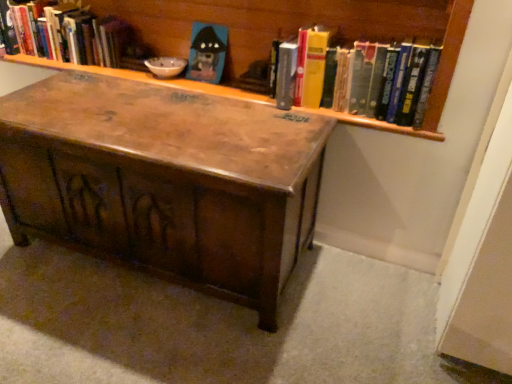
Question: Should I look upward or downward to see hardcover books at upper right, which is the 2th book from left to right?

Choices:
 (A) down
 (B) up

Answer: (B)

Question: Are matte plastic toy at upper center and wooden trunk at center located far from each other?

Choices:
 (A) yes
 (B) no

Answer: (B)

Question: Is matte plastic toy at upper center smaller than wooden trunk at center?

Choices:
 (A) yes
 (B) no

Answer: (A)

Question: Considering the relative sizes of matte plastic toy at upper center and wooden trunk at center in the image provided, is matte plastic toy at upper center shorter than wooden trunk at center?

Choices:
 (A) no
 (B) yes

Answer: (B)

Question: Is matte plastic toy at upper center aimed at wooden trunk at center?

Choices:
 (A) yes
 (B) no

Answer: (B)

Question: Can you confirm if matte plastic toy at upper center is positioned to the right of wooden trunk at center?

Choices:
 (A) yes
 (B) no

Answer: (A)

Question: Can you see matte plastic toy at upper center touching wooden trunk at center?

Choices:
 (A) yes
 (B) no

Answer: (B)

Question: Considering the relative positions of wooden trunk at center and matte plastic toy at upper center in the image provided, is wooden trunk at center to the left of matte plastic toy at upper center from the viewer's perspective?

Choices:
 (A) no
 (B) yes

Answer: (B)

Question: From a real-world perspective, is wooden trunk at center physically above matte plastic toy at upper center?

Choices:
 (A) no
 (B) yes

Answer: (A)

Question: Are wooden trunk at center and matte plastic toy at upper center far apart?

Choices:
 (A) no
 (B) yes

Answer: (A)

Question: From the image's perspective, is wooden trunk at center on top of matte plastic toy at upper center?

Choices:
 (A) yes
 (B) no

Answer: (B)

Question: Considering the relative sizes of wooden trunk at center and matte plastic toy at upper center in the image provided, is wooden trunk at center bigger than matte plastic toy at upper center?

Choices:
 (A) no
 (B) yes

Answer: (B)

Question: Is wooden trunk at center taller than matte plastic toy at upper center?

Choices:
 (A) yes
 (B) no

Answer: (A)

Question: Does wooden bookcase at upper center have a lesser width compared to hardcover book at upper left, positioned as the 2th book in front-to-back order?

Choices:
 (A) yes
 (B) no

Answer: (B)